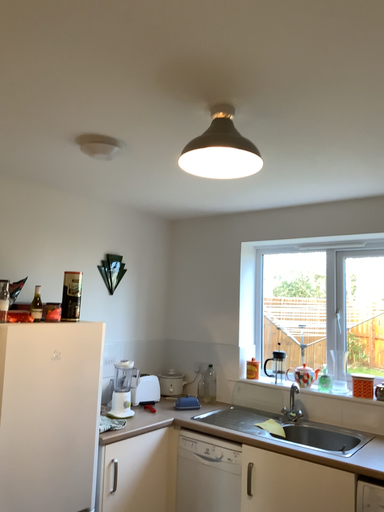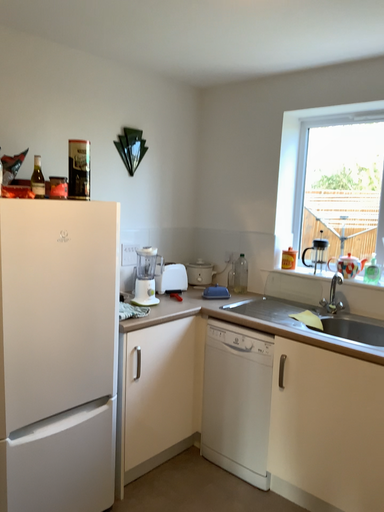
Question: How did the camera likely rotate when shooting the video?

Choices:
 (A) rotated downward
 (B) rotated upward

Answer: (A)